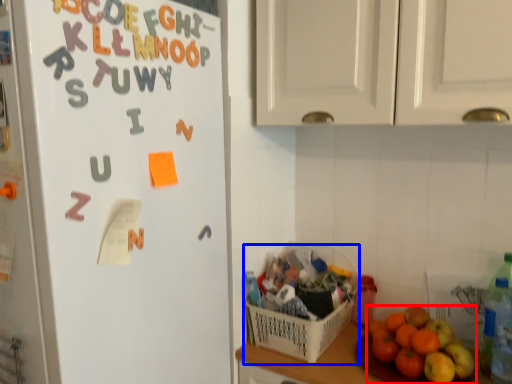
Question: Which object appears farthest to the camera in this image, grapefruit (highlighted by a red box) or basket (highlighted by a blue box)?

Choices:
 (A) grapefruit
 (B) basket

Answer: (B)